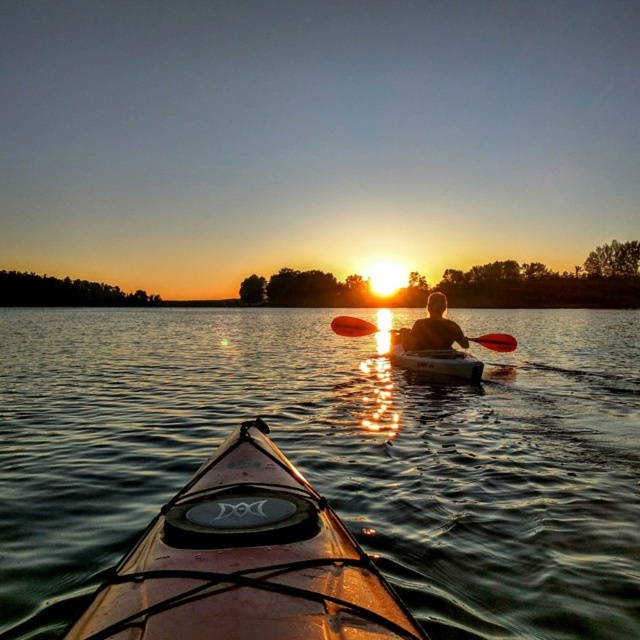
Question: Does translucent water at center appear over matte black kayak at center?

Choices:
 (A) yes
 (B) no

Answer: (B)

Question: Is translucent water at center closer to camera compared to brown matte canoe at center?

Choices:
 (A) no
 (B) yes

Answer: (A)

Question: Which of the following is the closest to the observer?

Choices:
 (A) (282, 440)
 (B) (492, 339)

Answer: (A)

Question: Which point is closer to the camera?

Choices:
 (A) [x=502, y=436]
 (B) [x=403, y=625]

Answer: (B)

Question: Does white plastic canoe at center have a lesser width compared to matte orange paddle at center?

Choices:
 (A) yes
 (B) no

Answer: (A)

Question: Which of the following is the farthest from the observer?

Choices:
 (A) (456, 323)
 (B) (337, 323)

Answer: (B)